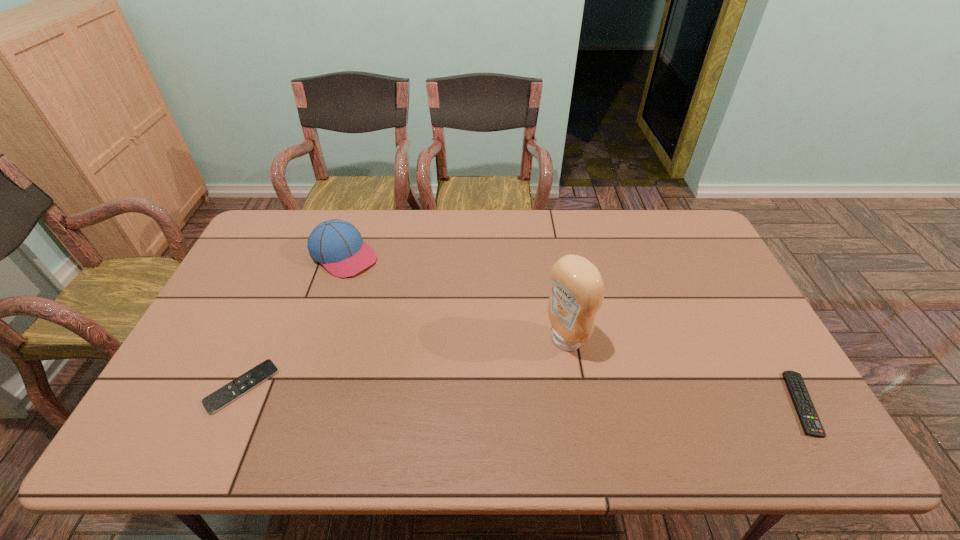
Where is `object located in the near right corner section of the desktop`? object located in the near right corner section of the desktop is located at coordinates (807, 414).

You are a GUI agent. You are given a task and a screenshot of the screen. Output one action in this format:
    pyautogui.click(x=<x>, y=<y>)
    Task: Click on the vacant space at the far edge of the desktop
    
    Given the screenshot: What is the action you would take?
    pyautogui.click(x=500, y=249)

At what (x,y) coordinates should I click in order to perform the action: click on free location at the near edge. Please return your answer as a coordinate pair (x, y). Looking at the image, I should click on (316, 406).

Identify the location of vacant space at the left edge of the desktop. (276, 289).

Identify the location of vacant space at the right edge of the desktop. This screenshot has width=960, height=540. (735, 312).

At what (x,y) coordinates should I click in order to perform the action: click on vacant space at the far right corner. Please return your answer as a coordinate pair (x, y). Looking at the image, I should click on (688, 214).

Locate an element on the screen. empty space between the tallest object and the second shortest object is located at coordinates (684, 372).

Image resolution: width=960 pixels, height=540 pixels. I want to click on free spot between the baseball cap and the condiment, so click(455, 298).

In order to click on vacant area between the third object from left to right and the shortest object in this screenshot , I will do `click(403, 363)`.

The image size is (960, 540). In order to click on vacant region between the farthest object and the second object from right to left in this screenshot , I will do `click(455, 298)`.